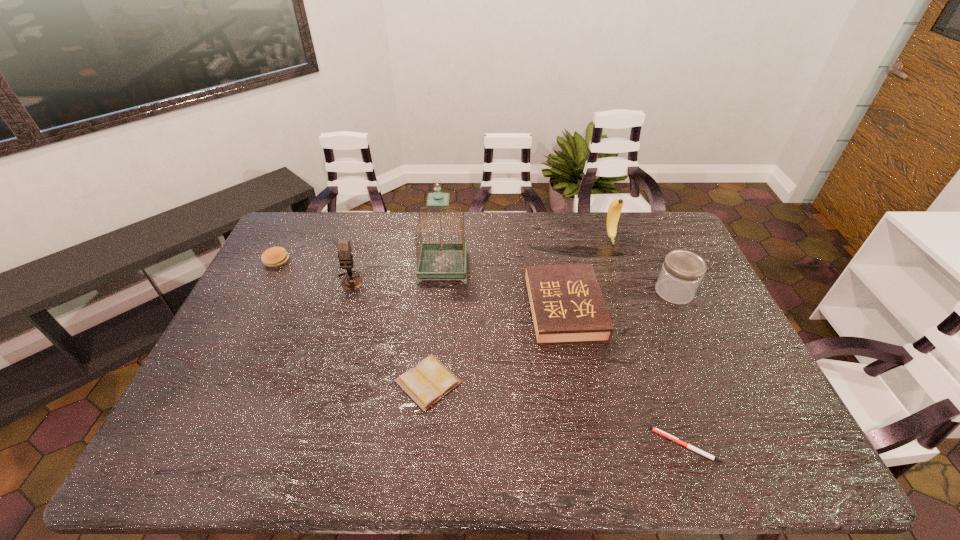
Identify the location of birdcage. (441, 259).

I want to click on the farthest object, so click(x=614, y=210).

At what (x,y) coordinates should I click in order to perform the action: click on the second object from left to right. Please return your answer as a coordinate pair (x, y). Image resolution: width=960 pixels, height=540 pixels. Looking at the image, I should click on (351, 282).

Where is `jar`? This screenshot has height=540, width=960. jar is located at coordinates (682, 271).

This screenshot has width=960, height=540. In order to click on the fifth shortest object in this screenshot , I will do `click(682, 271)`.

The image size is (960, 540). Identify the location of the fourth object from right to left. (567, 305).

Locate an element on the screen. This screenshot has width=960, height=540. the fifth tallest object is located at coordinates (567, 305).

Where is `the leftmost object`? The image size is (960, 540). the leftmost object is located at coordinates (274, 257).

Identify the location of the sixth tallest object. (274, 257).

This screenshot has height=540, width=960. Find the location of `diary`. diary is located at coordinates (426, 383).